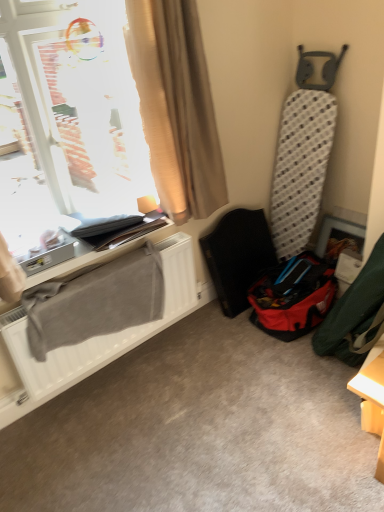
Question: Is point (129, 334) positioned closer to the camera than point (327, 292)?

Choices:
 (A) farther
 (B) closer

Answer: (B)

Question: Considering the relative positions of white matte radiator at lower left and red fabric bag at lower right in the image provided, is white matte radiator at lower left to the left or to the right of red fabric bag at lower right?

Choices:
 (A) left
 (B) right

Answer: (A)

Question: Which object is the closest to the white matte radiator at lower left?

Choices:
 (A) plastic textured folding chair at center right
 (B) transparent glass window at upper left
 (C) beige fabric curtain at upper left
 (D) red fabric bag at lower right

Answer: (A)

Question: Which object is positioned closest to the beige fabric curtain at upper left?

Choices:
 (A) white matte radiator at lower left
 (B) red fabric bag at lower right
 (C) plastic textured folding chair at center right
 (D) transparent glass window at upper left

Answer: (D)